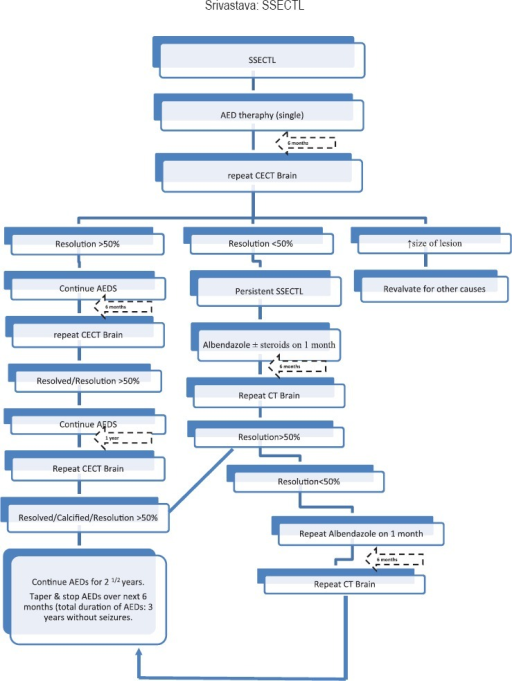
Identify the location of middle column. (257, 20), (249, 180), (265, 255), (271, 329), (283, 411), (285, 443).